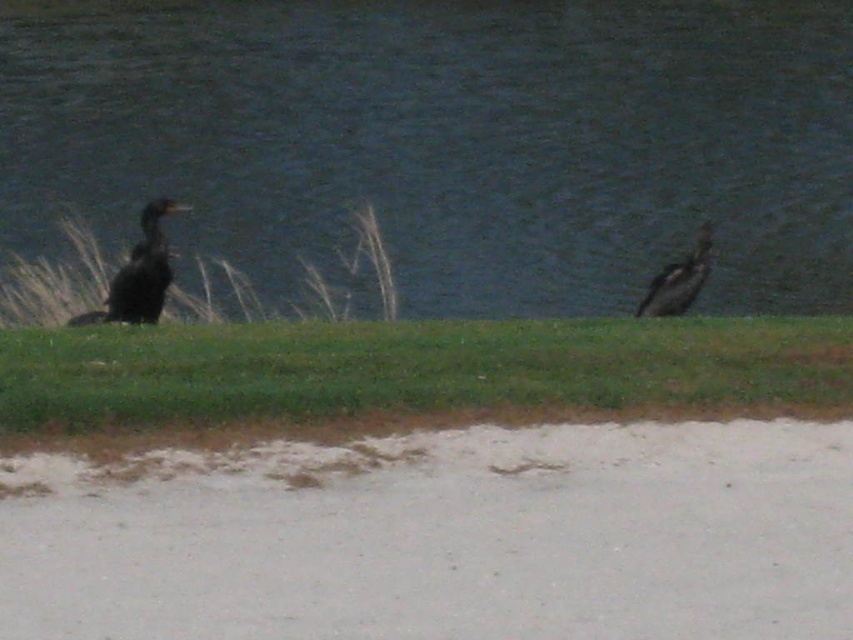
Question: Based on their relative distances, which object is nearer to the green grass at center?

Choices:
 (A) dark brown feathers at right
 (B) dark brown feathers at left
 (C) dark blue water at center

Answer: (B)

Question: Which of the following is the farthest from the observer?

Choices:
 (A) dark blue water at center
 (B) dark brown feathers at left
 (C) green grass at center
 (D) dark brown feathers at right

Answer: (D)

Question: Which point is closer to the camera?

Choices:
 (A) dark brown feathers at left
 (B) dark brown feathers at right
 (C) green grass at center
 (D) dark blue water at center

Answer: (C)

Question: Does dark blue water at center appear on the left side of green grass at center?

Choices:
 (A) yes
 (B) no

Answer: (B)

Question: Is dark blue water at center thinner than green grass at center?

Choices:
 (A) yes
 (B) no

Answer: (B)

Question: Can you confirm if green grass at center is wider than dark brown feathers at left?

Choices:
 (A) no
 (B) yes

Answer: (B)